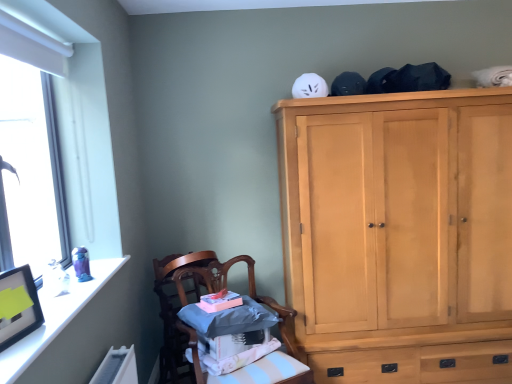
What do you see at coordinates (399, 234) in the screenshot? The image size is (512, 384). I see `light wood cabinet at upper right` at bounding box center [399, 234].

The image size is (512, 384). In order to click on wooden chair at lower left, acting as the second chair starting from the back in this screenshot , I will do `click(226, 286)`.

You are a GUI agent. You are given a task and a screenshot of the screen. Output one action in this format:
    pyautogui.click(x=<x>, y=<y>)
    Task: Click on the wooden chair at lower left, the first chair from the back
    The width and height of the screenshot is (512, 384).
    Given the screenshot: What is the action you would take?
    pyautogui.click(x=175, y=314)

Locate an element on the screen. Image resolution: width=512 pixels, height=384 pixels. light wood cabinet at upper right is located at coordinates (399, 234).

In terms of width, does light wood cabinet at upper right look wider or thinner when compared to wooden chair at lower left, which appears as the 1th chair when viewed from the front?

In the image, light wood cabinet at upper right appears to be wider than wooden chair at lower left, which appears as the 1th chair when viewed from the front.

Is light wood cabinet at upper right looking in the opposite direction of wooden chair at lower left, acting as the second chair starting from the back?

light wood cabinet at upper right is not turned away from wooden chair at lower left, acting as the second chair starting from the back.

Is light wood cabinet at upper right to the left of wooden chair at lower left, acting as the second chair starting from the back, from the viewer's perspective?

No, light wood cabinet at upper right is not to the left of wooden chair at lower left, acting as the second chair starting from the back.

Is wooden chair at lower left, arranged as the 2th chair when viewed from the front, at the left side of light wood cabinet at upper right?

Correct, you'll find wooden chair at lower left, arranged as the 2th chair when viewed from the front, to the left of light wood cabinet at upper right.

From the image's perspective, which one is positioned higher, wooden chair at lower left, the first chair from the back, or light wood cabinet at upper right?

light wood cabinet at upper right appears higher in the image.

From a real-world perspective, is wooden chair at lower left, arranged as the 2th chair when viewed from the front, physically below light wood cabinet at upper right?

Yes, from a real-world perspective, wooden chair at lower left, arranged as the 2th chair when viewed from the front, is below light wood cabinet at upper right.

Considering the sizes of wooden chair at lower left, the first chair from the back, and light wood cabinet at upper right in the image, is wooden chair at lower left, the first chair from the back, wider or thinner than light wood cabinet at upper right?

In the image, wooden chair at lower left, the first chair from the back, appears to be more narrow than light wood cabinet at upper right.

Considering the sizes of objects white glossy frame at upper left and light wood cabinet at upper right in the image provided, who is taller, white glossy frame at upper left or light wood cabinet at upper right?

Standing taller between the two is light wood cabinet at upper right.

What's the angular difference between white glossy frame at upper left and light wood cabinet at upper right's facing directions?

The angle between the facing direction of white glossy frame at upper left and the facing direction of light wood cabinet at upper right is 89 degrees.

Is point (4, 371) positioned after point (393, 338)?

No, (4, 371) is closer to viewer.

Between white glossy frame at upper left and light wood cabinet at upper right, which one has larger size?

light wood cabinet at upper right is bigger.

From a real-world perspective, is wooden chair at lower left, acting as the second chair starting from the back, below white glossy frame at upper left?

Yes, from a real-world perspective, wooden chair at lower left, acting as the second chair starting from the back, is below white glossy frame at upper left.

Looking at this image, from the image's perspective, is wooden chair at lower left, which appears as the 1th chair when viewed from the front, located above white glossy frame at upper left?

No, from the image's perspective, wooden chair at lower left, which appears as the 1th chair when viewed from the front, is not on top of white glossy frame at upper left.

Considering the relative positions of wooden chair at lower left, which appears as the 1th chair when viewed from the front, and white glossy frame at upper left in the image provided, is wooden chair at lower left, which appears as the 1th chair when viewed from the front, to the left of white glossy frame at upper left from the viewer's perspective?

No.

Is white glossy frame at upper left located within wooden chair at lower left, which appears as the 1th chair when viewed from the front?

No.

From the image's perspective, between white glossy frame at upper left and wooden chair at lower left, the first chair from the back, which one is located above?

white glossy frame at upper left is shown above in the image.

Who is smaller, white glossy frame at upper left or wooden chair at lower left, the first chair from the back?

Smaller between the two is white glossy frame at upper left.

The height and width of the screenshot is (384, 512). What are the coordinates of `chair that is the 2nd one when counting backward from the white glossy frame at upper left` in the screenshot? It's located at (175, 314).

Is white glossy frame at upper left located outside wooden chair at lower left, arranged as the 2th chair when viewed from the front?

Yes, white glossy frame at upper left is outside of wooden chair at lower left, arranged as the 2th chair when viewed from the front.

Is wooden chair at lower left, arranged as the 2th chair when viewed from the front, aimed at wooden chair at lower left, acting as the second chair starting from the back?

Yes, wooden chair at lower left, arranged as the 2th chair when viewed from the front, is turned towards wooden chair at lower left, acting as the second chair starting from the back.

Find the location of a particular element. chair below the wooden chair at lower left, the first chair from the back (from the image's perspective) is located at coordinates (226, 286).

Considering the positions of objects wooden chair at lower left, arranged as the 2th chair when viewed from the front, and wooden chair at lower left, which appears as the 1th chair when viewed from the front, in the image provided, who is more to the left, wooden chair at lower left, arranged as the 2th chair when viewed from the front, or wooden chair at lower left, which appears as the 1th chair when viewed from the front,?

Positioned to the left is wooden chair at lower left, arranged as the 2th chair when viewed from the front.

Which is more to the right, light wood cabinet at upper right or wooden chair at lower left, arranged as the 2th chair when viewed from the front?

light wood cabinet at upper right.

Would you say light wood cabinet at upper right is outside wooden chair at lower left, arranged as the 2th chair when viewed from the front?

Absolutely, light wood cabinet at upper right is external to wooden chair at lower left, arranged as the 2th chair when viewed from the front.

Could you tell me if light wood cabinet at upper right is facing wooden chair at lower left, arranged as the 2th chair when viewed from the front?

No, light wood cabinet at upper right is not aimed at wooden chair at lower left, arranged as the 2th chair when viewed from the front.

In order to click on the 2nd chair to the left of the light wood cabinet at upper right, starting your count from the anchor in this screenshot , I will do `click(175, 314)`.

You are a GUI agent. You are given a task and a screenshot of the screen. Output one action in this format:
    pyautogui.click(x=<x>, y=<y>)
    Task: Click on the cabinetry that appears above the wooden chair at lower left, which appears as the 1th chair when viewed from the front (from the image's perspective)
    
    Given the screenshot: What is the action you would take?
    pyautogui.click(x=399, y=234)

Starting from the light wood cabinet at upper right, which chair is the 2nd one to the left? Please provide its 2D coordinates.

[(175, 314)]

When comparing their distances from light wood cabinet at upper right, does wooden chair at lower left, the first chair from the back, or wooden chair at lower left, acting as the second chair starting from the back, seem closer?

wooden chair at lower left, acting as the second chair starting from the back, is closer to light wood cabinet at upper right.

Consider the image. When comparing their distances from white glossy frame at upper left, does light wood cabinet at upper right or wooden chair at lower left, arranged as the 2th chair when viewed from the front, seem further?

Based on the image, light wood cabinet at upper right appears to be further to white glossy frame at upper left.

Estimate the real-world distances between objects in this image. Which object is closer to white glossy frame at upper left, wooden chair at lower left, the first chair from the back, or light wood cabinet at upper right?

The object closer to white glossy frame at upper left is wooden chair at lower left, the first chair from the back.

Looking at the image, which one is located closer to light wood cabinet at upper right, wooden chair at lower left, which appears as the 1th chair when viewed from the front, or wooden chair at lower left, the first chair from the back?

wooden chair at lower left, which appears as the 1th chair when viewed from the front, is closer to light wood cabinet at upper right.

In the scene shown: Which object lies nearer to the anchor point wooden chair at lower left, the first chair from the back, wooden chair at lower left, acting as the second chair starting from the back, or white glossy frame at upper left?

wooden chair at lower left, acting as the second chair starting from the back, is closer to wooden chair at lower left, the first chair from the back.

Considering their positions, is light wood cabinet at upper right positioned closer to wooden chair at lower left, arranged as the 2th chair when viewed from the front, than white glossy frame at upper left?

white glossy frame at upper left.

Considering their positions, is wooden chair at lower left, acting as the second chair starting from the back, positioned further to light wood cabinet at upper right than white glossy frame at upper left?

white glossy frame at upper left is positioned further to the anchor light wood cabinet at upper right.

From the image, which object appears to be farther from wooden chair at lower left, which appears as the 1th chair when viewed from the front, light wood cabinet at upper right or wooden chair at lower left, arranged as the 2th chair when viewed from the front?

light wood cabinet at upper right is further to wooden chair at lower left, which appears as the 1th chair when viewed from the front.

Locate an element on the screen. The width and height of the screenshot is (512, 384). chair located between white glossy frame at upper left and wooden chair at lower left, the first chair from the back, in the depth direction is located at coordinates (226, 286).

The image size is (512, 384). What are the coordinates of `chair between wooden chair at lower left, arranged as the 2th chair when viewed from the front, and light wood cabinet at upper right from left to right` in the screenshot? It's located at (226, 286).